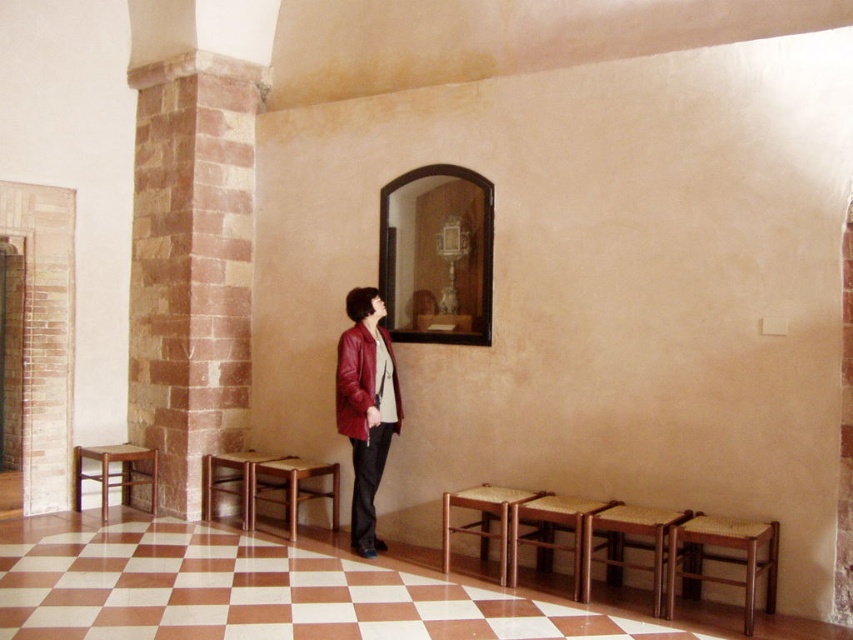
Which of these two, woven wood stool at lower right or leather jacket at center, stands shorter?

woven wood stool at lower right is shorter.

Between point (752, 525) and point (347, 330), which one is positioned in front?

Point (752, 525)

Does point (764, 572) come in front of point (351, 429)?

That is True.

Locate an element on the screen. This screenshot has height=640, width=853. woven wood stool at lower right is located at coordinates (721, 557).

Is woven wood stool at lower right positioned in front of wooden stool at center?

Yes.

Between woven wood stool at lower right and wooden stool at center, which one has more height?

With more height is wooden stool at center.

In the scene shown: Who is more forward, (769, 573) or (277, 477)?

Point (769, 573) is in front.

You are a GUI agent. You are given a task and a screenshot of the screen. Output one action in this format:
    pyautogui.click(x=<x>, y=<y>)
    Task: Click on the woven wood stool at lower right
    The image size is (853, 640).
    Given the screenshot: What is the action you would take?
    pyautogui.click(x=721, y=557)

This screenshot has width=853, height=640. Identify the location of matte red leather jacket at center. (364, 406).

Is point (376, 420) less distant than point (125, 444)?

Yes, point (376, 420) is in front of point (125, 444).

Who is more forward, (363, 289) or (113, 461)?

Positioned in front is point (363, 289).

This screenshot has width=853, height=640. In order to click on matte red leather jacket at center in this screenshot , I will do `click(364, 406)`.